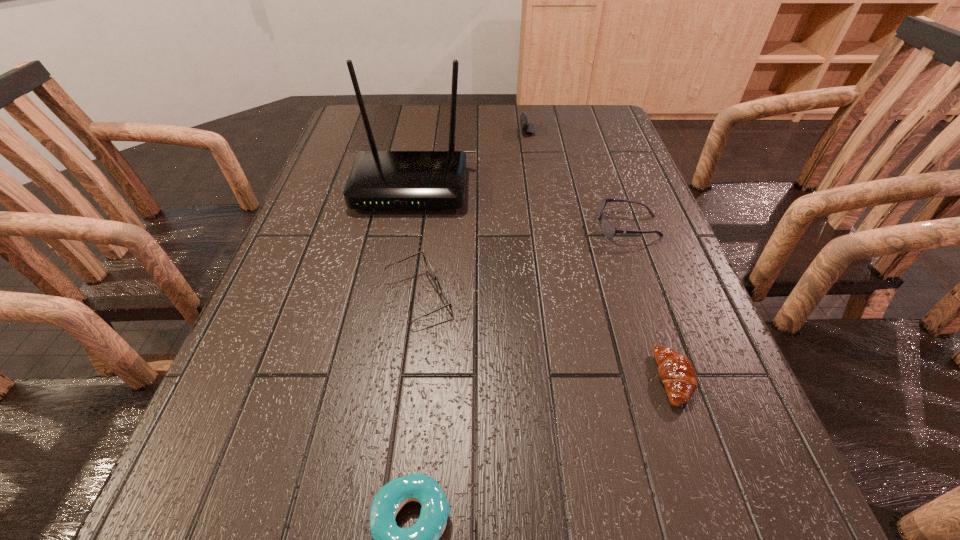
I want to click on router, so click(378, 179).

Locate an element on the screen. the fourth farthest object is located at coordinates (445, 295).

Find the location of `webcam`. webcam is located at coordinates (528, 127).

Where is `sunglasses`? The image size is (960, 540). sunglasses is located at coordinates (x=608, y=229).

This screenshot has width=960, height=540. Identify the location of crescent roll. (676, 372).

Locate an element on the screen. vacant space located 0.360m on the front-facing side of the tallest object is located at coordinates (382, 336).

The width and height of the screenshot is (960, 540). Identify the location of vacant point located 0.070m with the lenses facing outward on the spectacles. (489, 296).

Identify the location of vacant position located on the front-facing side of the webcam. The image size is (960, 540). (448, 130).

I want to click on free space located on the front-facing side of the webcam, so click(x=439, y=130).

This screenshot has height=540, width=960. Find the location of `vacant region located on the front-facing side of the webcam`. vacant region located on the front-facing side of the webcam is located at coordinates (494, 130).